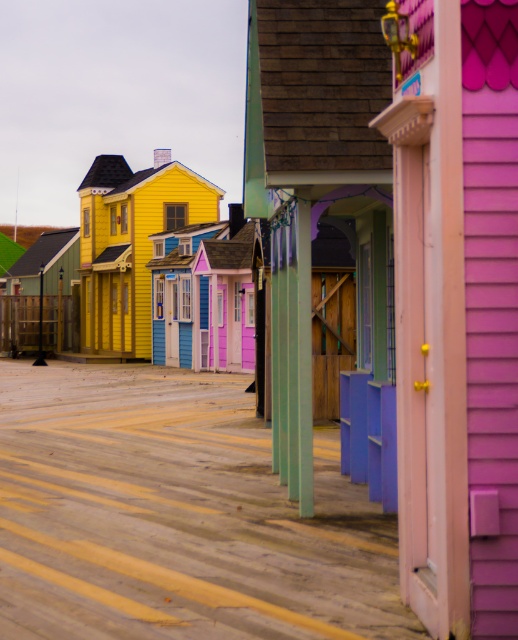
Who is shorter, purple wood porch at center or matte yellow house at center?

purple wood porch at center

Based on the photo, which is more to the left, purple wood porch at center or matte yellow house at center?

From the viewer's perspective, matte yellow house at center appears more on the left side.

Does point (375, 356) lie in front of point (133, 289)?

Yes, it is.

At what (x,y) coordinates should I click in order to perform the action: click on purple wood porch at center. Please return your answer as a coordinate pair (x, y). Looking at the image, I should click on (323, 224).

Does purple wood porch at center appear on the left side of green matte hut at center?

In fact, purple wood porch at center is to the right of green matte hut at center.

This screenshot has width=518, height=640. Identify the location of purple wood porch at center. (323, 224).

The image size is (518, 640). In order to click on purple wood porch at center in this screenshot , I will do `click(323, 224)`.

At what (x,y) coordinates should I click in order to perform the action: click on matte yellow house at center. Please return your answer as a coordinate pair (x, y). Looking at the image, I should click on (130, 244).

Who is more distant from viewer, (204, 198) or (4, 282)?

The point (4, 282) is more distant.

The height and width of the screenshot is (640, 518). Describe the element at coordinates (130, 244) in the screenshot. I see `matte yellow house at center` at that location.

At what (x,y) coordinates should I click in order to perform the action: click on matte yellow house at center. Please return your answer as a coordinate pair (x, y). The height and width of the screenshot is (640, 518). Looking at the image, I should click on (130, 244).